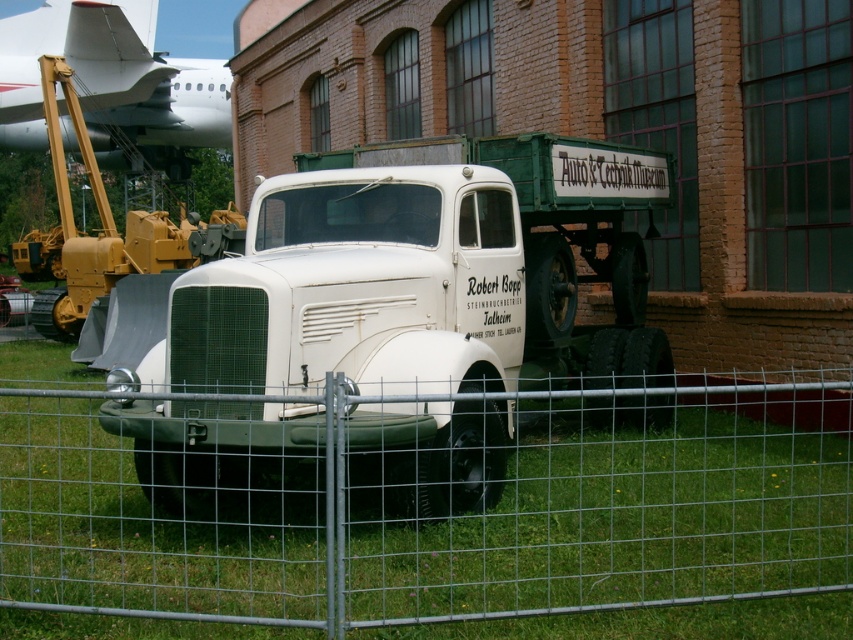
Question: Does green grass at lower center come behind white matte trailer truck at center?

Choices:
 (A) no
 (B) yes

Answer: (B)

Question: Which object is the farthest from the green grass at lower center?

Choices:
 (A) white glossy airplane at upper left
 (B) white matte trailer truck at center
 (C) white matte truck at center

Answer: (A)

Question: Which point is closer to the camera taking this photo?

Choices:
 (A) 155,225
 (B) 279,280
 (C) 151,120
 (D) 682,557

Answer: (D)

Question: Which point is closer to the camera?

Choices:
 (A) white matte truck at center
 (B) white glossy airplane at upper left

Answer: (A)

Question: In this image, where is green grass at lower center located relative to white matte trailer truck at center?

Choices:
 (A) left
 (B) right

Answer: (B)

Question: In this image, where is white matte trailer truck at center located relative to white glossy airplane at upper left?

Choices:
 (A) left
 (B) right

Answer: (B)